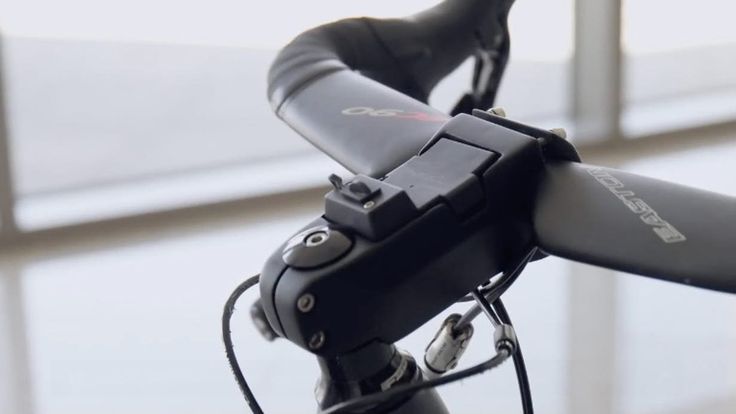
Image resolution: width=736 pixels, height=414 pixels. In order to click on cable in this screenshot , I will do `click(229, 348)`.